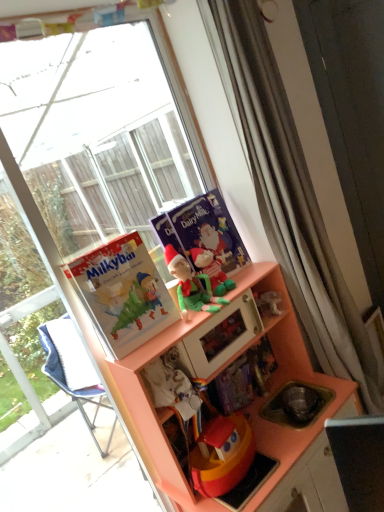
Question: Considering their positions, is green fabric elf at upper center located in front of or behind transparent glass window at upper left?

Choices:
 (A) front
 (B) behind

Answer: (B)

Question: Considering the positions of green fabric elf at upper center and transparent glass window at upper left in the image, is green fabric elf at upper center taller or shorter than transparent glass window at upper left?

Choices:
 (A) tall
 (B) short

Answer: (B)

Question: Considering the real-world distances, which object is farthest from the green plush toy at center, the second toy viewed from the front?

Choices:
 (A) transparent glass window at upper left
 (B) green felt elf at center, which ranks as the 1th toy in front-to-back order
 (C) matte purple comic book at center, which is the second comic book from front to back
 (D) green fabric elf at upper center
 (E) matte orange cabinet at center

Answer: (A)

Question: Considering the real-world distances, which object is closest to the green plush toy at center, the second toy viewed from the front?

Choices:
 (A) green felt elf at center, which ranks as the 1th toy in front-to-back order
 (B) matte paper comic book at left, the 1th comic book when ordered from front to back
 (C) matte orange cabinet at center
 (D) green fabric elf at upper center
 (E) transparent glass window at upper left

Answer: (A)